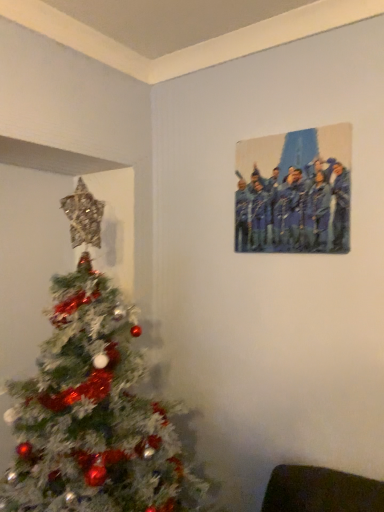
Question: In terms of width, does shiny metallic christmas tree at left look wider or thinner when compared to metallic blue painting at upper right?

Choices:
 (A) thin
 (B) wide

Answer: (B)

Question: Is point (137, 441) positioned closer to the camera than point (286, 181)?

Choices:
 (A) closer
 (B) farther

Answer: (A)

Question: Is shiny metallic christmas tree at left taller or shorter than metallic blue painting at upper right?

Choices:
 (A) tall
 (B) short

Answer: (A)

Question: From their relative heights in the image, would you say metallic blue painting at upper right is taller or shorter than shiny metallic christmas tree at left?

Choices:
 (A) short
 (B) tall

Answer: (A)

Question: From a real-world perspective, is metallic blue painting at upper right positioned above or below shiny metallic christmas tree at left?

Choices:
 (A) below
 (B) above

Answer: (B)

Question: From the image's perspective, is metallic blue painting at upper right located above or below shiny metallic christmas tree at left?

Choices:
 (A) above
 (B) below

Answer: (A)

Question: Do you think metallic blue painting at upper right is within shiny metallic christmas tree at left, or outside of it?

Choices:
 (A) outside
 (B) inside

Answer: (A)